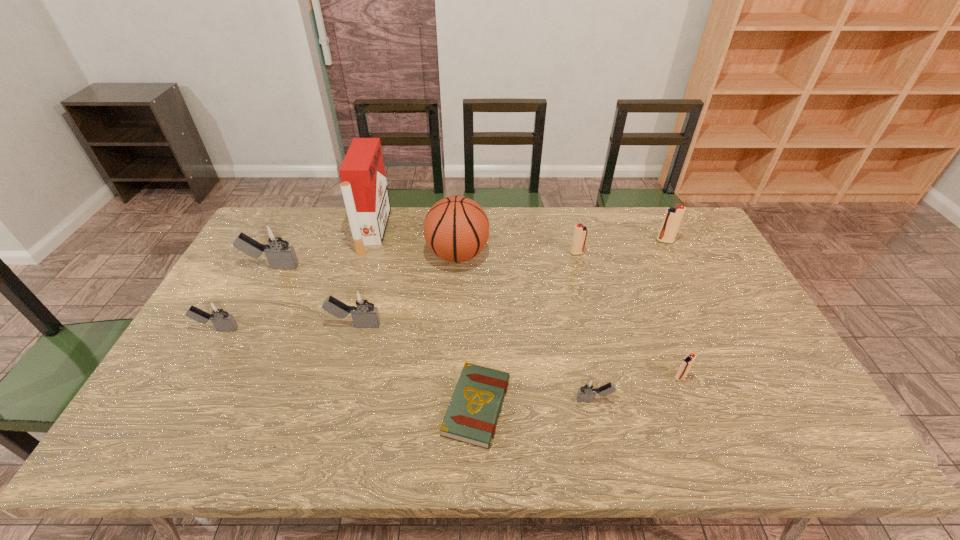
Where is `basketball present at the far edge`? The image size is (960, 540). basketball present at the far edge is located at coordinates (456, 229).

Find the location of `igniter that is at the far edge`. igniter that is at the far edge is located at coordinates (673, 216).

Locate an element on the screen. The width and height of the screenshot is (960, 540). object positioned at the near edge is located at coordinates (471, 417).

I want to click on object located at the right edge, so click(x=673, y=216).

Identify the location of object present at the far right corner. (673, 216).

In the image, there is a desktop. At what (x,y) coordinates should I click in order to perform the action: click on free space at the far edge. Please return your answer as a coordinate pair (x, y). The image size is (960, 540). Looking at the image, I should click on (328, 245).

You are a GUI agent. You are given a task and a screenshot of the screen. Output one action in this format:
    pyautogui.click(x=<x>, y=<y>)
    Task: Click on the vacant position at the near edge of the desktop
    
    Given the screenshot: What is the action you would take?
    pyautogui.click(x=493, y=437)

Identify the location of vacant area at the left edge. tap(233, 269).

The image size is (960, 540). Identify the location of free location at the right edge. (749, 375).

Image resolution: width=960 pixels, height=540 pixels. What are the coordinates of `free space that is in between the leftmost red igniter and the rightmost igniter` in the screenshot? It's located at (621, 247).